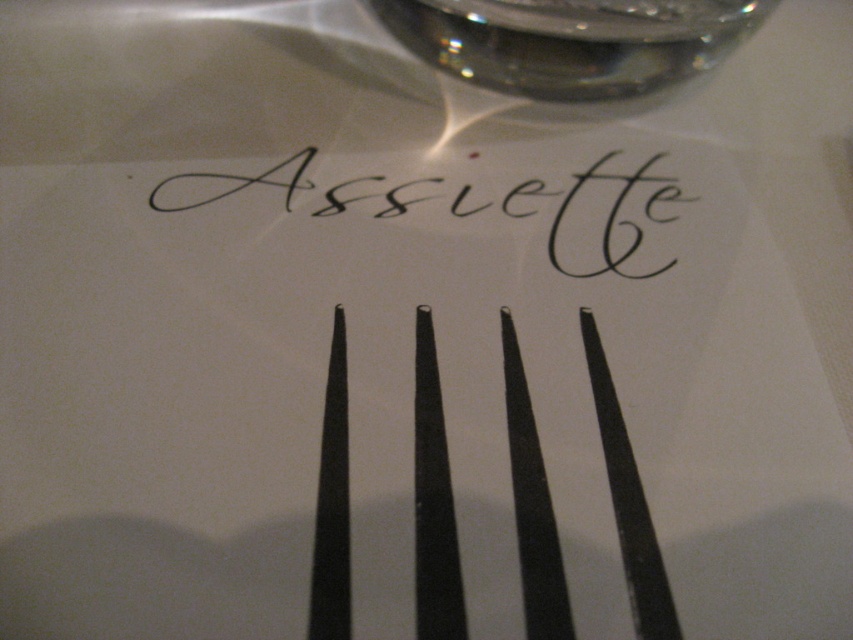
Question: Is black metal fork at center below black calligraphy at center?

Choices:
 (A) yes
 (B) no

Answer: (A)

Question: Can you confirm if black metal fork at center is thinner than black calligraphy at center?

Choices:
 (A) yes
 (B) no

Answer: (A)

Question: From the image, what is the correct spatial relationship of black metal fork at center in relation to black calligraphy at center?

Choices:
 (A) left
 (B) right

Answer: (B)